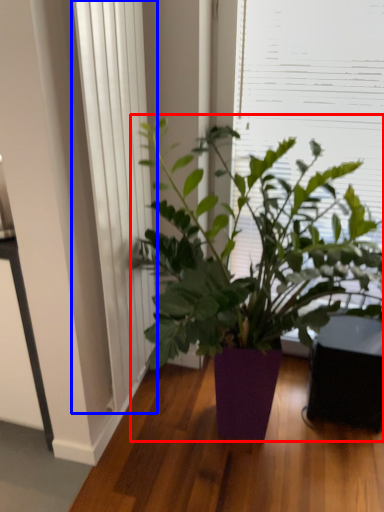
Question: Which of the following is the farthest to the observer, houseplant (highlighted by a red box) or curtain (highlighted by a blue box)?

Choices:
 (A) houseplant
 (B) curtain

Answer: (B)